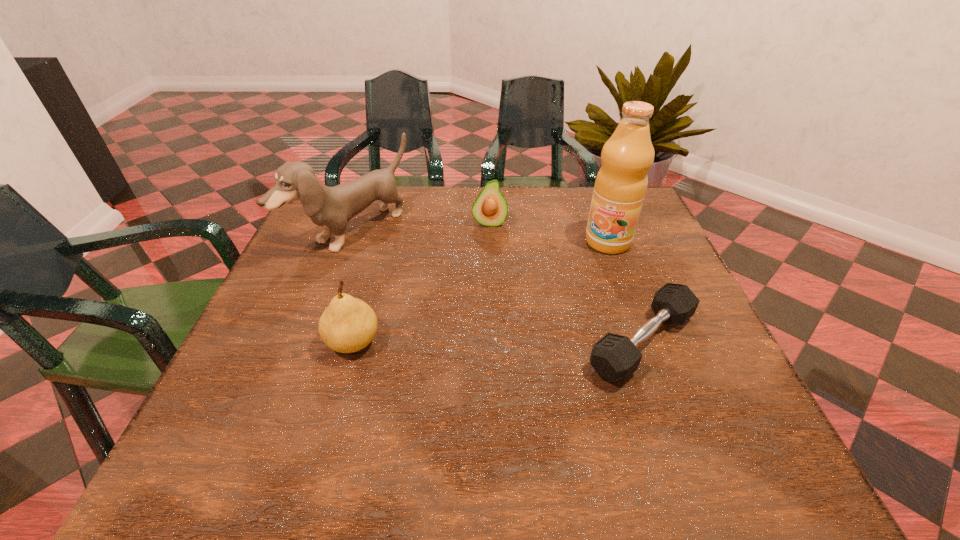
In the image, there is a desktop. At what (x,y) coordinates should I click in order to perform the action: click on blank space at the near left corner. Please return your answer as a coordinate pair (x, y). Looking at the image, I should click on (238, 411).

Find the location of `free spot at the far right corner of the desktop`. free spot at the far right corner of the desktop is located at coordinates (655, 232).

In the image, there is a desktop. At what (x,y) coordinates should I click in order to perform the action: click on free space at the near right corner. Please return your answer as a coordinate pair (x, y). Image resolution: width=960 pixels, height=540 pixels. Looking at the image, I should click on (651, 381).

Locate an element on the screen. free space between the third object from left to right and the pear is located at coordinates (421, 283).

You are a GUI agent. You are given a task and a screenshot of the screen. Output one action in this format:
    pyautogui.click(x=<x>, y=<y>)
    Task: Click on the vacant space in between the third object from left to right and the dumbbell
    
    Given the screenshot: What is the action you would take?
    pyautogui.click(x=565, y=282)

Where is `free space between the pear and the shortest object`? The height and width of the screenshot is (540, 960). free space between the pear and the shortest object is located at coordinates (497, 342).

You are a GUI agent. You are given a task and a screenshot of the screen. Output one action in this format:
    pyautogui.click(x=<x>, y=<y>)
    Task: Click on the vacant area between the tallest object and the avocado
    The height and width of the screenshot is (540, 960).
    Given the screenshot: What is the action you would take?
    pyautogui.click(x=548, y=233)

The image size is (960, 540). Identify the location of free spot between the third object from right to left and the tallest object. (548, 233).

At what (x,y) coordinates should I click in order to perform the action: click on free area in between the pear and the avocado. Please return your answer as a coordinate pair (x, y). The height and width of the screenshot is (540, 960). Looking at the image, I should click on (421, 283).

Locate an element on the screen. free space between the second tallest object and the tallest object is located at coordinates (480, 237).